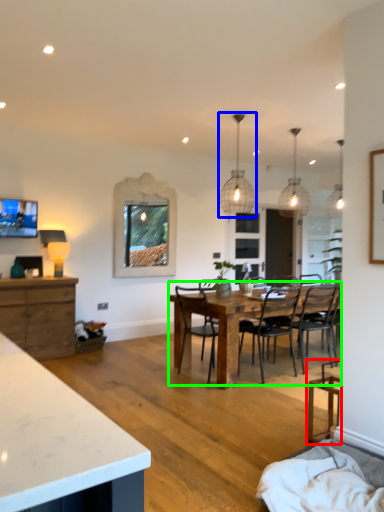
Question: Which object is positioned closest to chair (highlighted by a red box)? Select from light fixture (highlighted by a blue box) and kitchen & dining room table (highlighted by a green box).

Choices:
 (A) light fixture
 (B) kitchen & dining room table

Answer: (B)